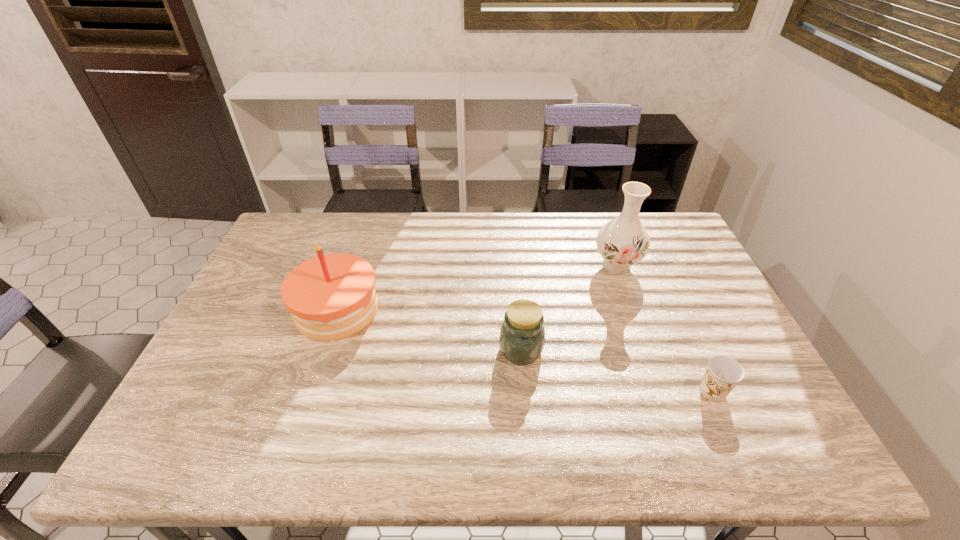
I want to click on the third object from left to right, so coord(622,242).

In order to click on the leftmost object in this screenshot , I will do `click(330, 297)`.

Where is `the third tallest object`? The height and width of the screenshot is (540, 960). the third tallest object is located at coordinates (522, 334).

You are a GUI agent. You are given a task and a screenshot of the screen. Output one action in this format:
    pyautogui.click(x=<x>, y=<y>)
    Task: Click on the third object from right to left
    The height and width of the screenshot is (540, 960).
    Given the screenshot: What is the action you would take?
    pyautogui.click(x=522, y=334)

I want to click on the shortest object, so click(723, 373).

At what (x,y) coordinates should I click in order to perform the action: click on the nearest object. Please return your answer as a coordinate pair (x, y). Image resolution: width=960 pixels, height=540 pixels. Looking at the image, I should click on (723, 373).

I want to click on vacant area situated 0.190m on the right of the vase, so click(x=700, y=266).

Where is `blank area located on the back of the leftmost object`? The height and width of the screenshot is (540, 960). blank area located on the back of the leftmost object is located at coordinates (360, 240).

You are a GUI agent. You are given a task and a screenshot of the screen. Output one action in this format:
    pyautogui.click(x=<x>, y=<y>)
    Task: Click on the vacant space located 0.050m on the right of the second object from left to right
    Image resolution: width=960 pixels, height=540 pixels.
    Given the screenshot: What is the action you would take?
    pyautogui.click(x=562, y=349)

Locate an element on the screen. This screenshot has height=540, width=960. vacant region located 0.180m on the back of the shortest object is located at coordinates (683, 325).